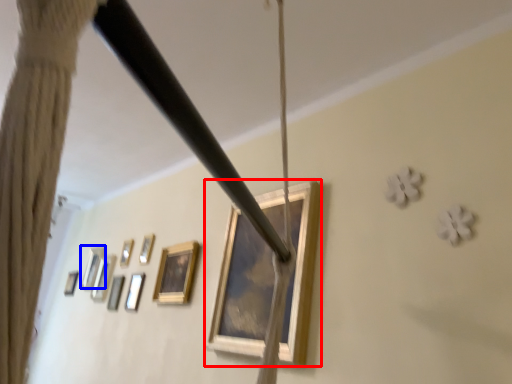
Question: Which object appears farthest to the camera in this image, picture frame (highlighted by a red box) or picture frame (highlighted by a blue box)?

Choices:
 (A) picture frame
 (B) picture frame

Answer: (B)